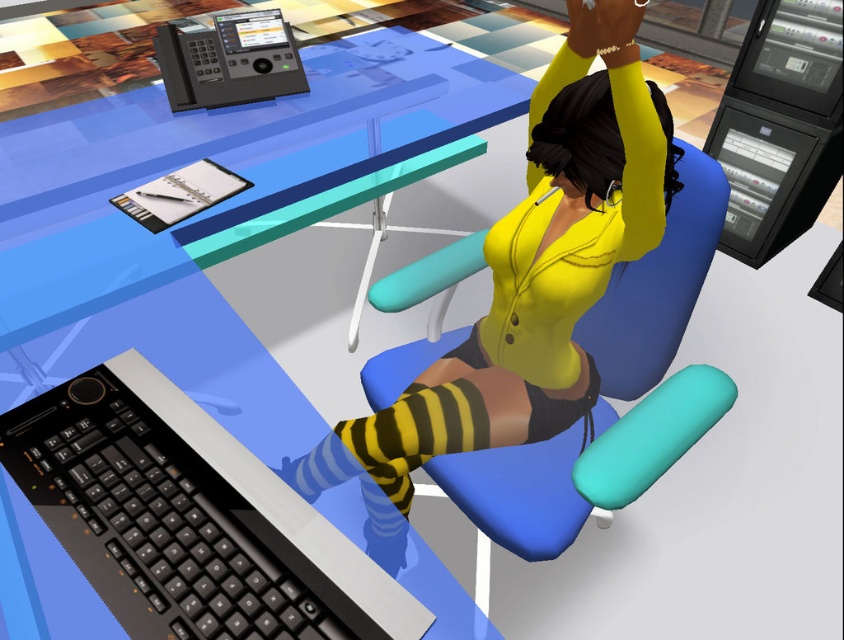
Between point (93, 288) and point (31, 451), which one is positioned in front?

Point (31, 451) is in front.

Which is above, blue plastic table at center or black plastic keyboard at lower left?

Positioned higher is blue plastic table at center.

Image resolution: width=844 pixels, height=640 pixels. Identify the location of blue plastic table at center. (206, 218).

This screenshot has width=844, height=640. I want to click on blue plastic table at center, so click(x=206, y=218).

Does black plastic keyboard at lower left lie in front of black plastic phone at upper left?

That is True.

Between point (347, 605) and point (204, 61), which one is positioned in front?

Point (347, 605) is in front.

Who is more forward, (231, 544) or (214, 81)?

Point (231, 544) is more forward.

Where is `black plastic keyboard at lower left`? The image size is (844, 640). black plastic keyboard at lower left is located at coordinates (160, 522).

Which of these two, blue plastic table at center or blue fabric chair at center, stands shorter?

blue fabric chair at center is shorter.

Is blue plastic table at center bigger than blue fabric chair at center?

Yes.

Identify the location of blue plastic table at center. The height and width of the screenshot is (640, 844). (206, 218).